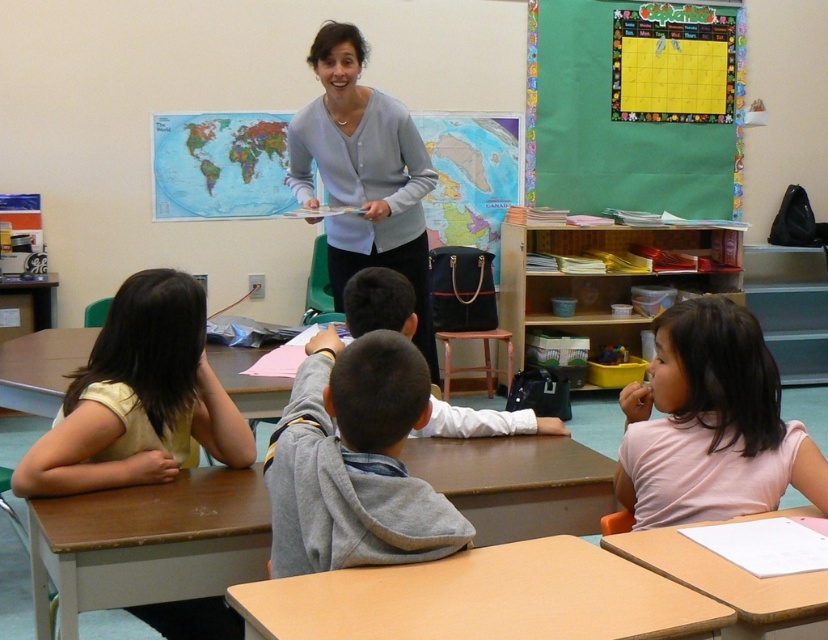
Question: Estimate the real-world distances between objects in this image. Which object is farther from the light yellow fabric shirt at left?

Choices:
 (A) brown wood desk at center
 (B) wooden desk at center

Answer: (B)

Question: Estimate the real-world distances between objects in this image. Which object is farther from the wooden desk at center?

Choices:
 (A) matte gray sweater at center
 (B) green fabric calendar at upper right
 (C) light yellow fabric shirt at left

Answer: (B)

Question: Which point is farther to the camera?

Choices:
 (A) brown wood desk at center
 (B) white cotton shirt at center
 (C) gray fleece hoodie at center
 (D) pink cotton shirt at lower right

Answer: (B)

Question: Does light brown wooden table at center have a smaller size compared to white cotton shirt at center?

Choices:
 (A) no
 (B) yes

Answer: (B)

Question: From the image, what is the correct spatial relationship of green fabric calendar at upper right in relation to gray fleece hoodie at center?

Choices:
 (A) above
 (B) below

Answer: (A)

Question: Is green fabric calendar at upper right positioned behind light yellow fabric shirt at left?

Choices:
 (A) yes
 (B) no

Answer: (A)